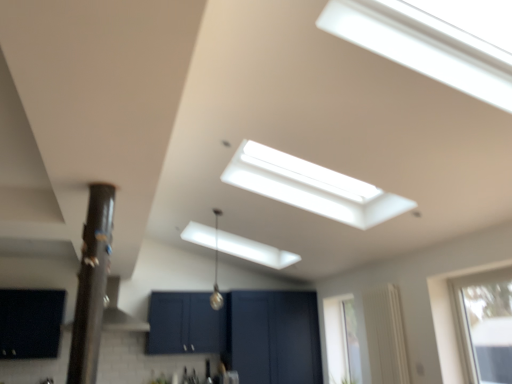
Question: Would you say transparent glass window at upper right, acting as the 3th window starting from the back, is outside clear glass window at right, which ranks as the first window in back-to-front order?

Choices:
 (A) no
 (B) yes

Answer: (B)

Question: Considering the relative positions of transparent glass window at upper right, acting as the 3th window starting from the back, and clear glass window at right, which is counted as the third window, starting from the front, in the image provided, is transparent glass window at upper right, acting as the 3th window starting from the back, to the left of clear glass window at right, which is counted as the third window, starting from the front, from the viewer's perspective?

Choices:
 (A) yes
 (B) no

Answer: (B)

Question: Does transparent glass window at upper right, positioned as the 1th window in right-to-left order, have a lesser height compared to clear glass window at right, which is counted as the third window, starting from the front?

Choices:
 (A) yes
 (B) no

Answer: (A)

Question: Does transparent glass window at upper right, acting as the 3th window starting from the back, lie behind clear glass window at right, which is counted as the third window, starting from the front?

Choices:
 (A) no
 (B) yes

Answer: (A)

Question: Is transparent glass window at upper right, acting as the 3th window starting from the back, far from clear glass window at right, marked as the second window in a right-to-left arrangement?

Choices:
 (A) no
 (B) yes

Answer: (B)

Question: Does point (101, 281) appear closer or farther from the camera than point (355, 377)?

Choices:
 (A) closer
 (B) farther

Answer: (A)

Question: Considering the positions of black glossy pole at left and clear glass window at right, marked as the second window in a right-to-left arrangement, in the image, is black glossy pole at left wider or thinner than clear glass window at right, marked as the second window in a right-to-left arrangement,?

Choices:
 (A) wide
 (B) thin

Answer: (A)

Question: Looking at the image, does black glossy pole at left seem bigger or smaller compared to clear glass window at right, marked as the second window in a right-to-left arrangement?

Choices:
 (A) small
 (B) big

Answer: (B)

Question: In the image, is black glossy pole at left positioned in front of or behind clear glass window at right, which ranks as the first window in back-to-front order?

Choices:
 (A) behind
 (B) front

Answer: (B)

Question: Considering the positions of point (83, 268) and point (221, 297), is point (83, 268) closer or farther from the camera than point (221, 297)?

Choices:
 (A) closer
 (B) farther

Answer: (A)

Question: From a real-world perspective, is black glossy pole at left physically located above or below metallic silver light fixture at upper center?

Choices:
 (A) above
 (B) below

Answer: (B)

Question: From their relative heights in the image, would you say black glossy pole at left is taller or shorter than metallic silver light fixture at upper center?

Choices:
 (A) tall
 (B) short

Answer: (A)

Question: Is black glossy pole at left in front of or behind metallic silver light fixture at upper center in the image?

Choices:
 (A) front
 (B) behind

Answer: (A)

Question: Choose the correct answer: Is metallic silver light fixture at upper center inside matte black cabinet at lower left, the second window viewed from the back, or outside it?

Choices:
 (A) inside
 (B) outside

Answer: (B)

Question: In terms of height, does metallic silver light fixture at upper center look taller or shorter compared to matte black cabinet at lower left, the 3th window viewed from the right?

Choices:
 (A) short
 (B) tall

Answer: (B)